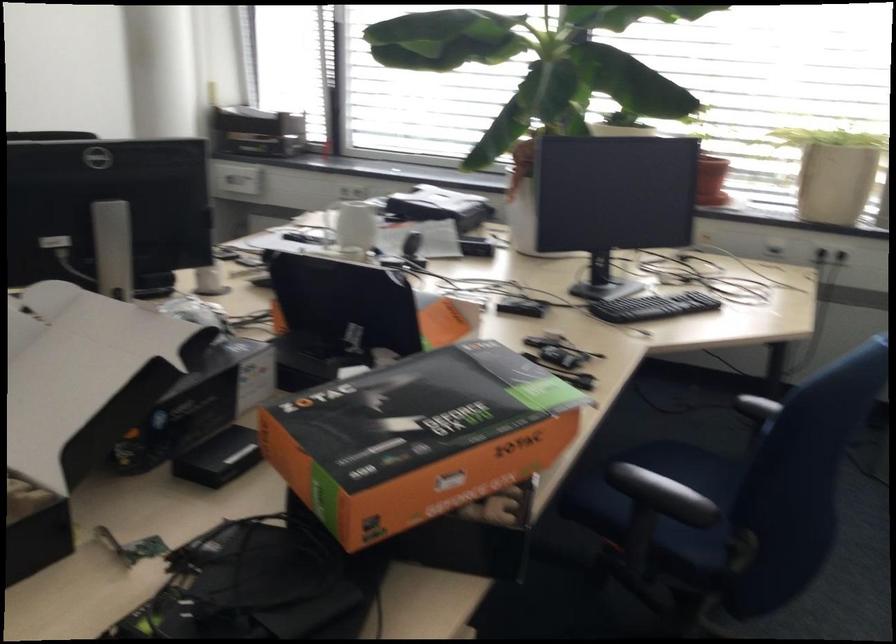
Which object does [220,458] point to?

This point indicates the small black box.